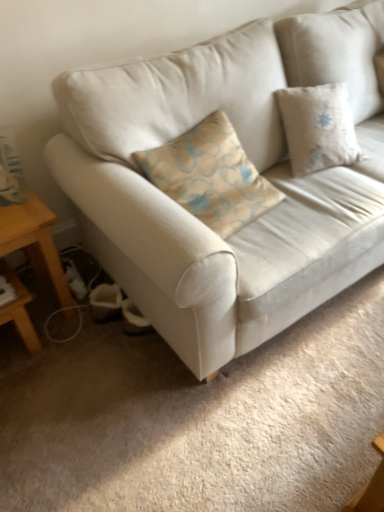
Question: In terms of width, does wooden table at lower left look wider or thinner when compared to suede-like beige couch at center?

Choices:
 (A) thin
 (B) wide

Answer: (A)

Question: Looking at the image, does wooden table at lower left seem bigger or smaller compared to suede-like beige couch at center?

Choices:
 (A) big
 (B) small

Answer: (B)

Question: Is wooden table at lower left taller or shorter than suede-like beige couch at center?

Choices:
 (A) tall
 (B) short

Answer: (B)

Question: Does point (324, 257) appear closer or farther from the camera than point (61, 298)?

Choices:
 (A) farther
 (B) closer

Answer: (B)

Question: From a real-world perspective, is suede-like beige couch at center above or below wooden table at lower left?

Choices:
 (A) above
 (B) below

Answer: (A)

Question: Is suede-like beige couch at center wider or thinner than wooden table at lower left?

Choices:
 (A) thin
 (B) wide

Answer: (B)

Question: Choose the correct answer: Is suede-like beige couch at center inside wooden table at lower left or outside it?

Choices:
 (A) outside
 (B) inside

Answer: (A)